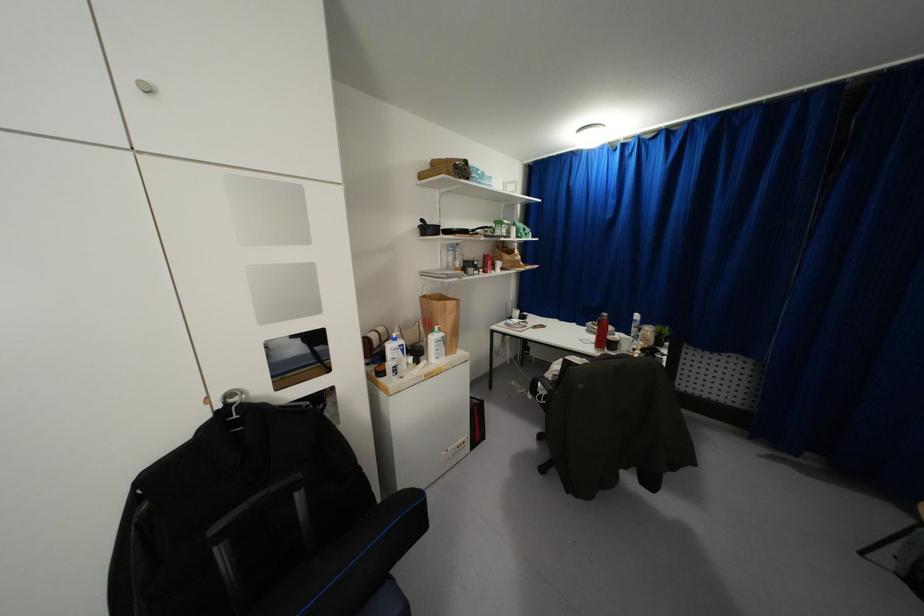
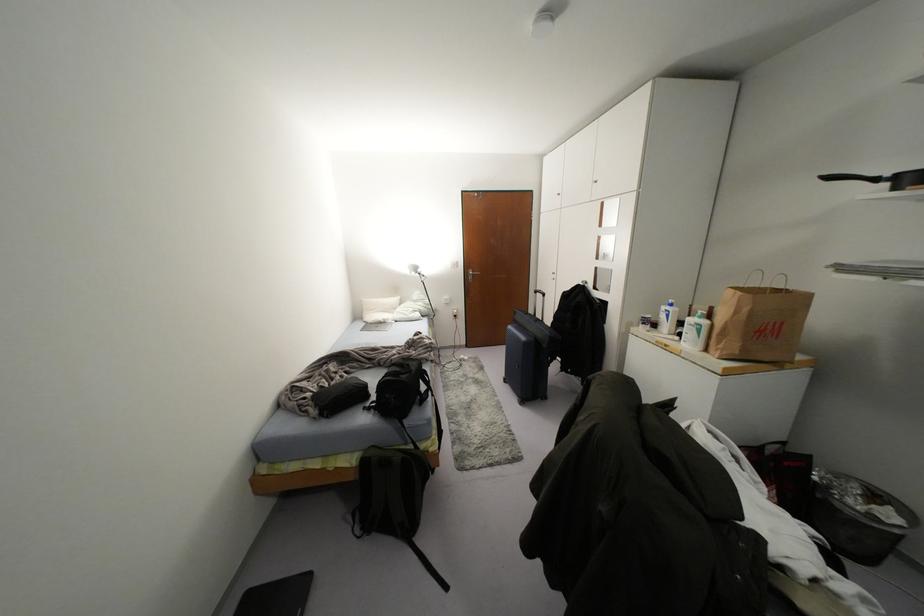
The point at (x=421, y=220) is marked in the first image. Where is the corresponding point in the second image?

(829, 177)